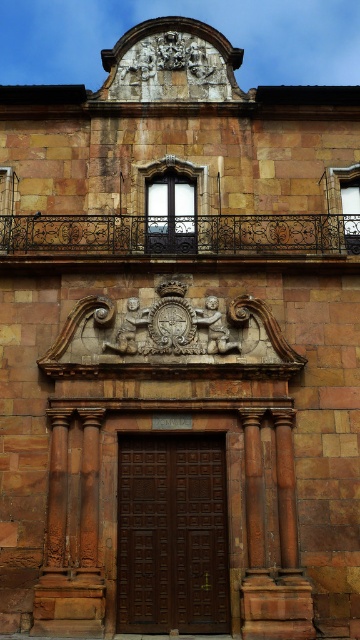
Is dark brown wood door at center above black wrought iron balcony at upper center?

Incorrect, dark brown wood door at center is not positioned above black wrought iron balcony at upper center.

Is dark brown wood door at center to the left of black wrought iron balcony at upper center from the viewer's perspective?

Yes, dark brown wood door at center is to the left of black wrought iron balcony at upper center.

Where is `dark brown wood door at center`? Image resolution: width=360 pixels, height=640 pixels. dark brown wood door at center is located at coordinates (172, 534).

The width and height of the screenshot is (360, 640). What are the coordinates of `dark brown wood door at center` in the screenshot? It's located at (172, 534).